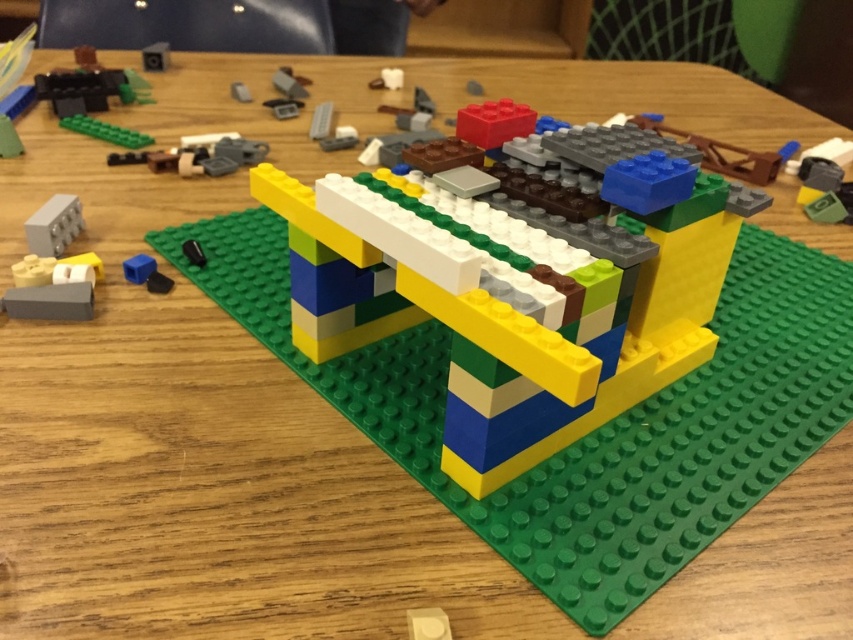
You are trying to find the matte plastic bridge at center in the LEGO structure. According to the coordinates provided, where exactly is it positioned on the table?

The matte plastic bridge at center is located at point coordinates of 0.444 on the x and 0.607 on the y axis.

You are a LEGO enthusiast trying to connect the matte plastic bridge at center to the gray matte brick at upper left. Given that your LEGO pieces can only reach up to 25 inches, will you be able to connect them without bending the pieces?

The matte plastic bridge at center is 24.96 inches away from the gray matte brick at upper left, so yes, you can connect them without bending the pieces since the distance is within the 25 inches limit.

You are a child trying to build a LEGO bridge. You see the matte plastic bridge at center and the gray matte brick at upper left on the table. Which object should you choose to use as a base for your bridge?

The matte plastic bridge at center is bigger than the gray matte brick at upper left, so you should choose the matte plastic bridge at center as the base for your bridge since it is larger and more suitable for building a bridge structure.